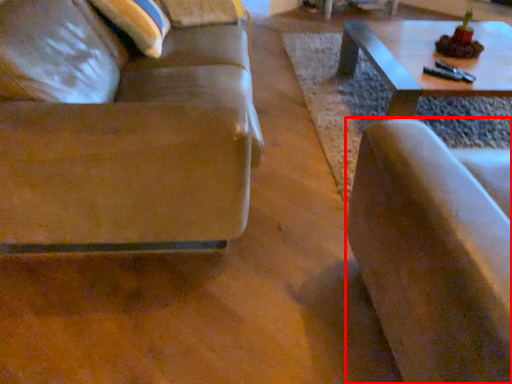
Question: Where is chair (annotated by the red box) located in relation to studio couch in the image?

Choices:
 (A) right
 (B) left

Answer: (A)